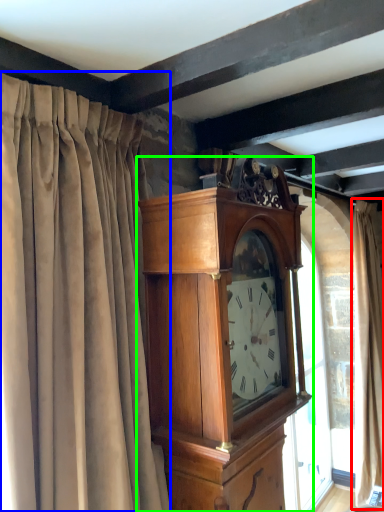
Question: Considering the real-world distances, which object is closest to curtain (highlighted by a red box)? curtain (highlighted by a blue box) or wall clock (highlighted by a green box).

Choices:
 (A) curtain
 (B) wall clock

Answer: (B)